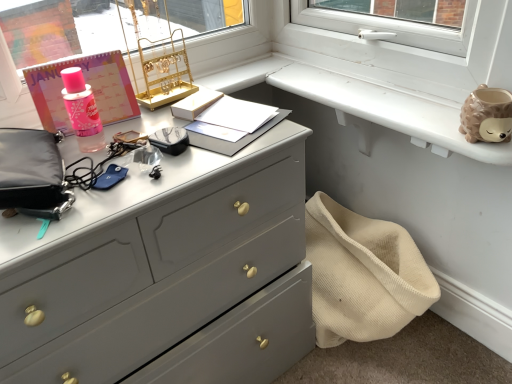
Question: Are white matte window sill at upper right and matte gray dresser at center located far from each other?

Choices:
 (A) no
 (B) yes

Answer: (A)

Question: Is white matte window sill at upper right positioned beyond the bounds of matte gray dresser at center?

Choices:
 (A) yes
 (B) no

Answer: (A)

Question: From a real-world perspective, is white matte window sill at upper right on matte gray dresser at center?

Choices:
 (A) yes
 (B) no

Answer: (A)

Question: Would you say white matte window sill at upper right contains matte gray dresser at center?

Choices:
 (A) no
 (B) yes

Answer: (A)

Question: From a real-world perspective, does white matte window sill at upper right sit lower than matte gray dresser at center?

Choices:
 (A) yes
 (B) no

Answer: (B)

Question: Considering the positions of gold metallic jewelry stand at upper center and matte black pouch at left in the image, is gold metallic jewelry stand at upper center taller or shorter than matte black pouch at left?

Choices:
 (A) short
 (B) tall

Answer: (B)

Question: Considering the relative positions of gold metallic jewelry stand at upper center and matte black pouch at left in the image provided, is gold metallic jewelry stand at upper center to the left or to the right of matte black pouch at left?

Choices:
 (A) right
 (B) left

Answer: (A)

Question: From a real-world perspective, is gold metallic jewelry stand at upper center physically located above or below matte black pouch at left?

Choices:
 (A) above
 (B) below

Answer: (A)

Question: From the image's perspective, is gold metallic jewelry stand at upper center located above or below matte black pouch at left?

Choices:
 (A) above
 (B) below

Answer: (A)

Question: Is gold metallic jewelry stand at upper center in front of or behind white matte window sill at upper right in the image?

Choices:
 (A) behind
 (B) front

Answer: (A)

Question: From a real-world perspective, is gold metallic jewelry stand at upper center physically located above or below white matte window sill at upper right?

Choices:
 (A) below
 (B) above

Answer: (B)

Question: Looking at their shapes, would you say gold metallic jewelry stand at upper center is wider or thinner than white matte window sill at upper right?

Choices:
 (A) wide
 (B) thin

Answer: (B)

Question: Does point (164, 77) appear closer or farther from the camera than point (437, 104)?

Choices:
 (A) closer
 (B) farther

Answer: (B)

Question: Is white matte window sill at upper right in front of or behind matte black pouch at left in the image?

Choices:
 (A) behind
 (B) front

Answer: (A)

Question: Considering the positions of white matte window sill at upper right and matte black pouch at left in the image, is white matte window sill at upper right wider or thinner than matte black pouch at left?

Choices:
 (A) wide
 (B) thin

Answer: (A)